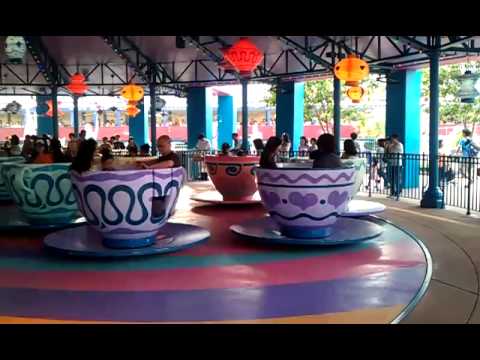
Identify the location of dark pink stripe pattern on floor. (405, 254), (319, 268), (199, 276), (111, 277), (30, 275).